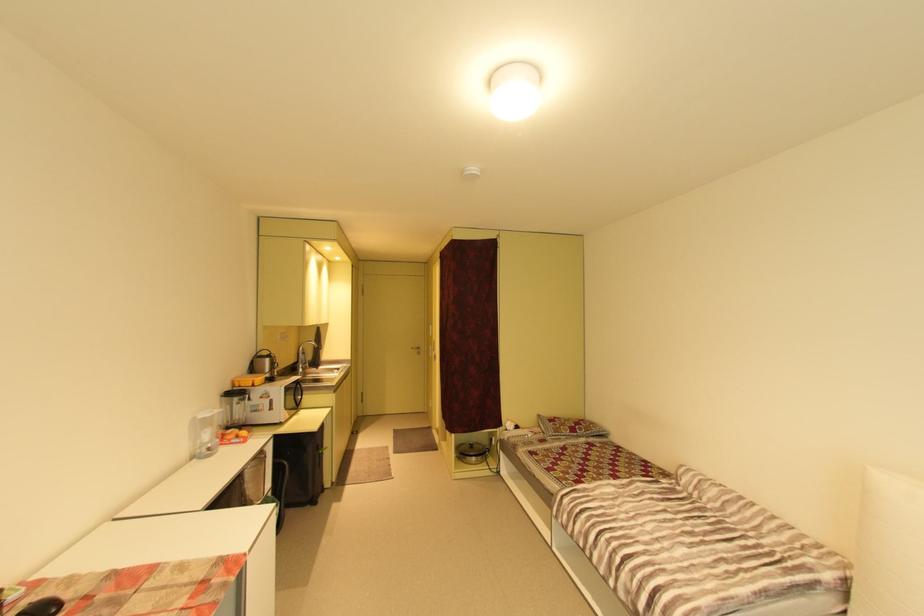
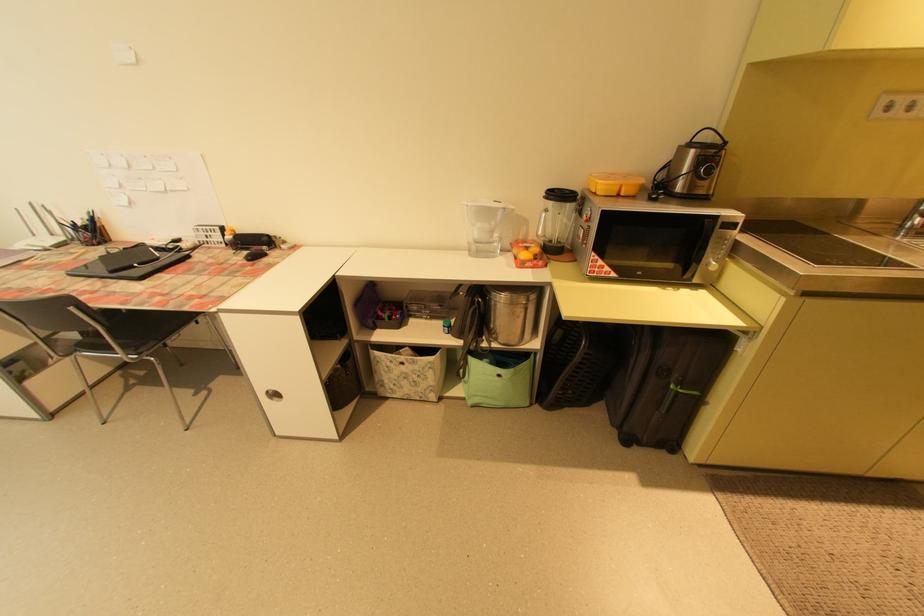
Where in the second image is the point corresponding to point 256,432 from the first image?

(541, 259)